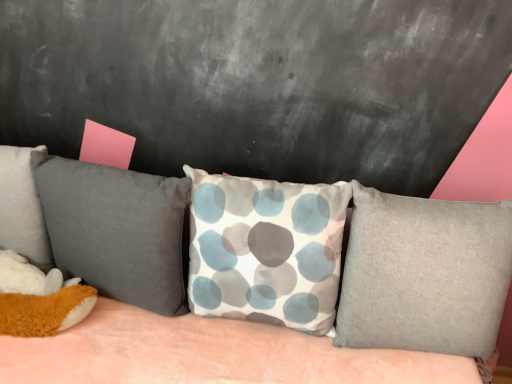
Question: Should I look upward or downward to see velvety gray pillow at left, positioned as the second pillow in left-to-right order?

Choices:
 (A) up
 (B) down

Answer: (B)

Question: Does white fabric pillow with blue and gray circles at center, which appears as the 2th pillow when viewed from the right, turn towards textured fabric couch at center?

Choices:
 (A) no
 (B) yes

Answer: (B)

Question: Is white fabric pillow with blue and gray circles at center, which appears as the 2th pillow when viewed from the right, at the right side of textured fabric couch at center?

Choices:
 (A) no
 (B) yes

Answer: (B)

Question: Considering the relative sizes of white fabric pillow with blue and gray circles at center, which appears as the 2th pillow when viewed from the right, and textured fabric couch at center in the image provided, is white fabric pillow with blue and gray circles at center, which appears as the 2th pillow when viewed from the right, bigger than textured fabric couch at center?

Choices:
 (A) yes
 (B) no

Answer: (B)

Question: Is white fabric pillow with blue and gray circles at center, the 3th pillow when ordered from left to right, to the left of textured fabric couch at center from the viewer's perspective?

Choices:
 (A) no
 (B) yes

Answer: (A)

Question: Is white fabric pillow with blue and gray circles at center, the 3th pillow when ordered from left to right, placed right next to textured fabric couch at center?

Choices:
 (A) yes
 (B) no

Answer: (B)

Question: Is white fabric pillow with blue and gray circles at center, which appears as the 2th pillow when viewed from the right, turned away from textured fabric couch at center?

Choices:
 (A) yes
 (B) no

Answer: (A)

Question: Is soft gray pillow at left, which is counted as the fourth pillow, starting from the right, surrounded by velvety gray pillow at left, positioned as the second pillow in left-to-right order?

Choices:
 (A) yes
 (B) no

Answer: (B)

Question: From the image's perspective, would you say velvety gray pillow at left, positioned as the second pillow in left-to-right order, is positioned over soft gray pillow at left, which is counted as the fourth pillow, starting from the right?

Choices:
 (A) yes
 (B) no

Answer: (B)

Question: Would you consider velvety gray pillow at left, positioned as the second pillow in left-to-right order, to be distant from soft gray pillow at left, the first pillow in the left-to-right sequence?

Choices:
 (A) yes
 (B) no

Answer: (B)

Question: Is velvety gray pillow at left, which appears as the third pillow when viewed from the right, to the right of soft gray pillow at left, which is counted as the fourth pillow, starting from the right, from the viewer's perspective?

Choices:
 (A) no
 (B) yes

Answer: (B)

Question: Is velvety gray pillow at left, positioned as the second pillow in left-to-right order, turned away from soft gray pillow at left, the first pillow in the left-to-right sequence?

Choices:
 (A) no
 (B) yes

Answer: (A)

Question: From a real-world perspective, is velvety gray pillow at left, which appears as the third pillow when viewed from the right, located beneath soft gray pillow at left, which is counted as the fourth pillow, starting from the right?

Choices:
 (A) no
 (B) yes

Answer: (B)

Question: From the image's perspective, is velvety gray pillow at left, which appears as the third pillow when viewed from the right, over textured fabric couch at center?

Choices:
 (A) no
 (B) yes

Answer: (B)